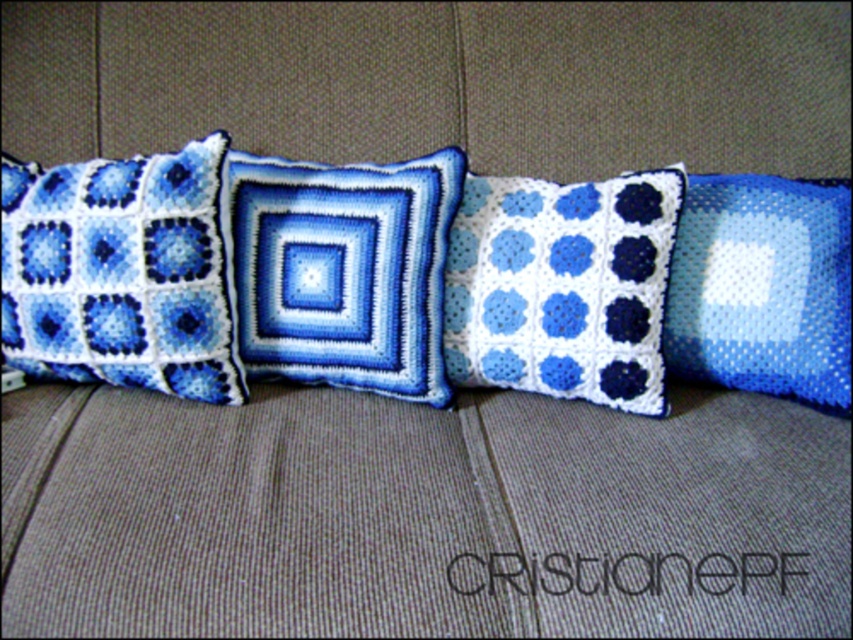
Question: Observing the image, what is the correct spatial positioning of white crochet pillow at center in reference to blue mesh pillow at right?

Choices:
 (A) above
 (B) below

Answer: (A)

Question: Is crochet fabric pillow at left to the left of blue mesh pillow at right from the viewer's perspective?

Choices:
 (A) yes
 (B) no

Answer: (A)

Question: Which object appears farthest from the camera in this image?

Choices:
 (A) crochet fabric pillow at left
 (B) blue mesh pillow at right
 (C) crochet cushion at center
 (D) white crochet pillow at center

Answer: (B)

Question: Is crochet cushion at center to the right of blue mesh pillow at right from the viewer's perspective?

Choices:
 (A) no
 (B) yes

Answer: (A)

Question: Which point is farther to the camera?

Choices:
 (A) crochet fabric pillow at left
 (B) white crochet pillow at center

Answer: (B)

Question: Considering the real-world distances, which object is farthest from the crochet fabric pillow at left?

Choices:
 (A) crochet cushion at center
 (B) white crochet pillow at center

Answer: (B)